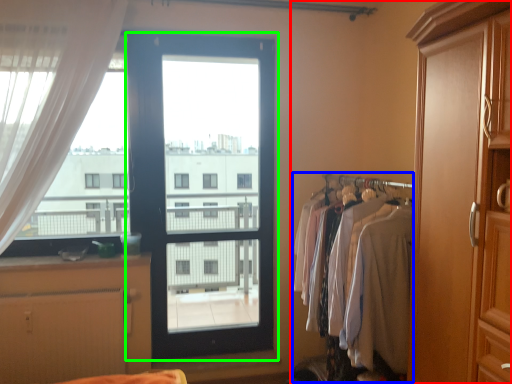
Question: Considering the real-world distances, which object is closest to dresser (highlighted by a red box)? laundry (highlighted by a blue box) or door (highlighted by a green box).

Choices:
 (A) laundry
 (B) door

Answer: (A)